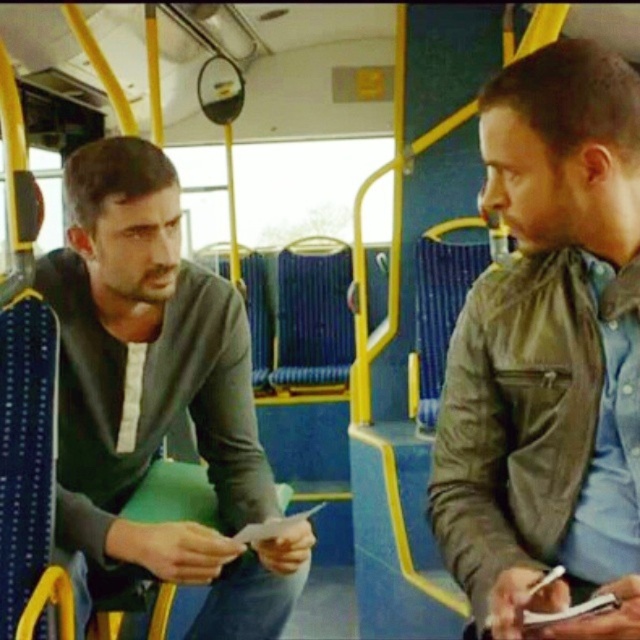
You are a passenger on a bus and you see two points marked in the scene. The first point is at coordinate point (627, 252) and the second is at point (132, 394). Which point is closer to the front of the bus?

Point (627, 252) is in front of point (132, 394), so the first point is closer to the front of the bus.

You are a passenger on a bus and you see the leather jacket at right and the dark gray sweater at left. Which one is closer to you?

The leather jacket at right is closer to you because it is in front of the dark gray sweater at left.